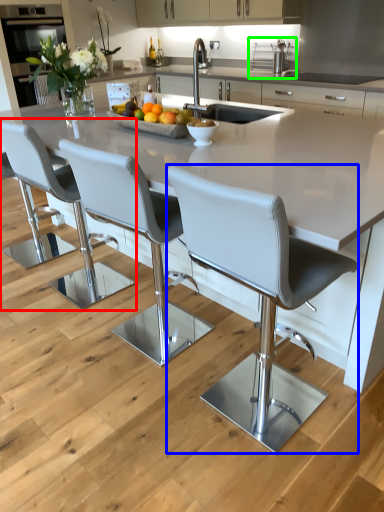
Question: Which is farther away from chair (highlighted by a red box)? chair (highlighted by a blue box) or stainless steel (highlighted by a green box)?

Choices:
 (A) chair
 (B) stainless steel

Answer: (B)